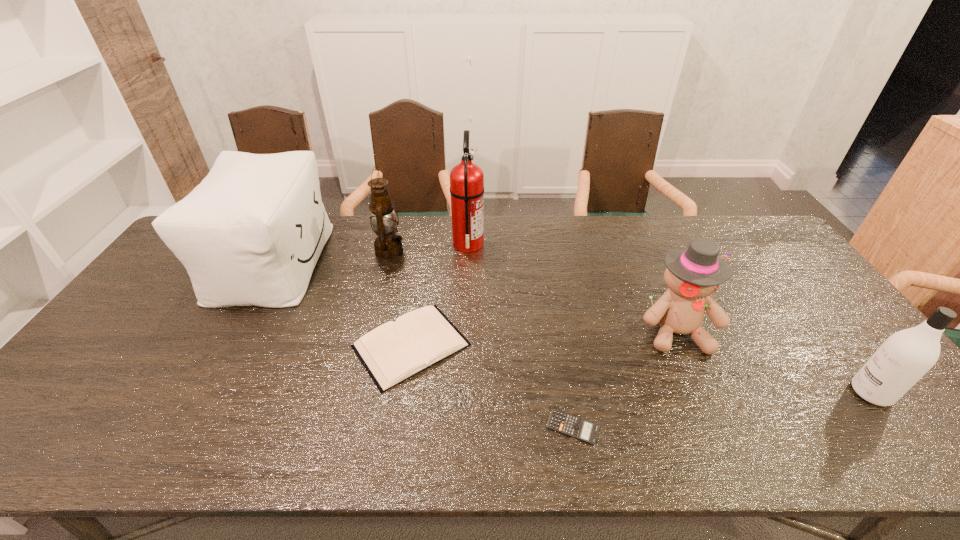
Identify the location of fire extinguisher. This screenshot has height=540, width=960. (466, 179).

This screenshot has width=960, height=540. I want to click on the leftmost object, so click(250, 234).

The width and height of the screenshot is (960, 540). I want to click on oil lamp, so click(x=388, y=246).

Where is `rag_doll`? The height and width of the screenshot is (540, 960). rag_doll is located at coordinates (692, 275).

Locate an element on the screen. shampoo is located at coordinates (906, 356).

The height and width of the screenshot is (540, 960). Find the location of `the sixth tallest object`. the sixth tallest object is located at coordinates (395, 351).

This screenshot has width=960, height=540. Find the location of `the nearest object`. the nearest object is located at coordinates [x=570, y=425].

Where is `the shortest object`? the shortest object is located at coordinates (570, 425).

Identify the location of free space located 0.290m at the nozzle of the fire extinguisher. (568, 244).

The height and width of the screenshot is (540, 960). I want to click on free space located on the side of the cushion with the smiley face, so click(370, 261).